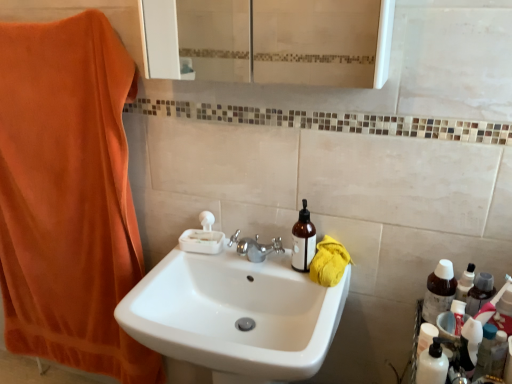
Question: Is white opaque bottle at lower right positioned in front of white glossy sink at center?

Choices:
 (A) yes
 (B) no

Answer: (B)

Question: Is white opaque bottle at lower right taller than white glossy sink at center?

Choices:
 (A) no
 (B) yes

Answer: (A)

Question: Would you say white opaque bottle at lower right is a long distance from white glossy sink at center?

Choices:
 (A) no
 (B) yes

Answer: (A)

Question: From a real-world perspective, is white opaque bottle at lower right physically below white glossy sink at center?

Choices:
 (A) no
 (B) yes

Answer: (A)

Question: Is white opaque bottle at lower right outside of white glossy sink at center?

Choices:
 (A) yes
 (B) no

Answer: (A)

Question: Would you say white glossy sink at center is to the left or to the right of white glossy bottle at right in the picture?

Choices:
 (A) right
 (B) left

Answer: (B)

Question: From a real-world perspective, relative to white glossy bottle at right, is white glossy sink at center vertically above or below?

Choices:
 (A) above
 (B) below

Answer: (B)

Question: Looking at the image, does white glossy sink at center seem bigger or smaller compared to white glossy bottle at right?

Choices:
 (A) small
 (B) big

Answer: (B)

Question: Is point (309, 327) closer or farther from the camera than point (494, 362)?

Choices:
 (A) closer
 (B) farther

Answer: (B)

Question: Does point click(500, 334) appear closer or farther from the camera than point click(302, 226)?

Choices:
 (A) farther
 (B) closer

Answer: (B)

Question: Considering the positions of white glossy bottle at right and matte brown bottle at center, arranged as the first bottle when viewed from the left, in the image, is white glossy bottle at right taller or shorter than matte brown bottle at center, arranged as the first bottle when viewed from the left,?

Choices:
 (A) short
 (B) tall

Answer: (A)

Question: In terms of width, does white glossy bottle at right look wider or thinner when compared to matte brown bottle at center, arranged as the first bottle when viewed from the left?

Choices:
 (A) thin
 (B) wide

Answer: (B)

Question: Is white glossy bottle at right in front of or behind matte brown bottle at center, arranged as the first bottle when viewed from the left, in the image?

Choices:
 (A) behind
 (B) front

Answer: (B)

Question: In the image, is white glossy sink at center on the left side or the right side of orange plush towel at left, the first beach towel when ordered from top to bottom?

Choices:
 (A) right
 (B) left

Answer: (A)

Question: From the image's perspective, relative to orange plush towel at left, placed as the 2th beach towel when sorted from right to left, is white glossy sink at center above or below?

Choices:
 (A) below
 (B) above

Answer: (A)